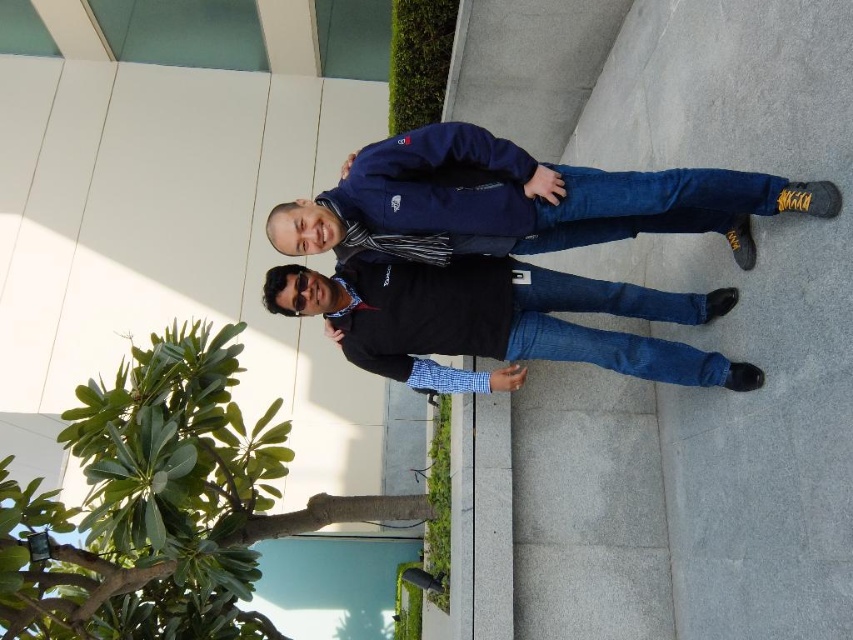
Question: Which object appears farthest from the camera in this image?

Choices:
 (A) navy blue fleece jacket at upper center
 (B) black matte shirt at center

Answer: (B)

Question: Is navy blue fleece jacket at upper center bigger than black matte shirt at center?

Choices:
 (A) yes
 (B) no

Answer: (A)

Question: In this image, where is navy blue fleece jacket at upper center located relative to black matte shirt at center?

Choices:
 (A) above
 (B) below

Answer: (A)

Question: Can you confirm if navy blue fleece jacket at upper center is positioned above black matte shirt at center?

Choices:
 (A) yes
 (B) no

Answer: (A)